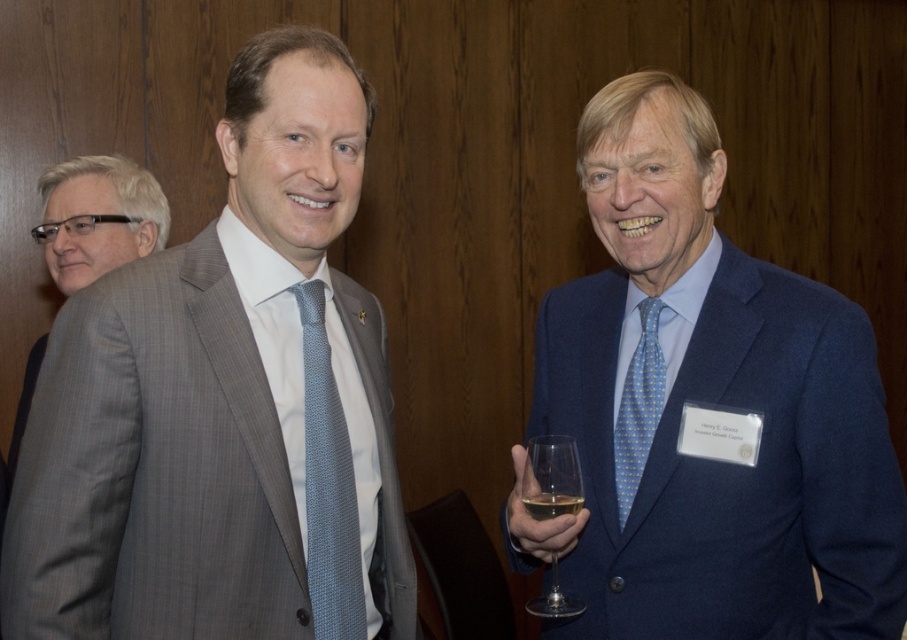
Question: Is gray pinstripe suit at left thinner than clear glass wine glass at right?

Choices:
 (A) no
 (B) yes

Answer: (A)

Question: Is gray pinstripe suit at center in front of blue dotted tie at right?

Choices:
 (A) yes
 (B) no

Answer: (A)

Question: Which of the following is the closest to the observer?

Choices:
 (A) blue dotted tie at right
 (B) blue dotted silk tie at right
 (C) gray pinstripe suit at center
 (D) blue textured tie at center

Answer: (C)

Question: Which of the following is the farthest from the observer?

Choices:
 (A) translucent glass at center
 (B) blue dotted tie at right
 (C) clear glass wine glass at right

Answer: (B)

Question: Which of the following is the farthest from the observer?

Choices:
 (A) click(x=551, y=504)
 (B) click(x=98, y=172)
 (C) click(x=132, y=531)
 (D) click(x=539, y=506)

Answer: (B)

Question: Does blue dotted tie at right have a larger size compared to gray pinstripe suit at left?

Choices:
 (A) yes
 (B) no

Answer: (A)